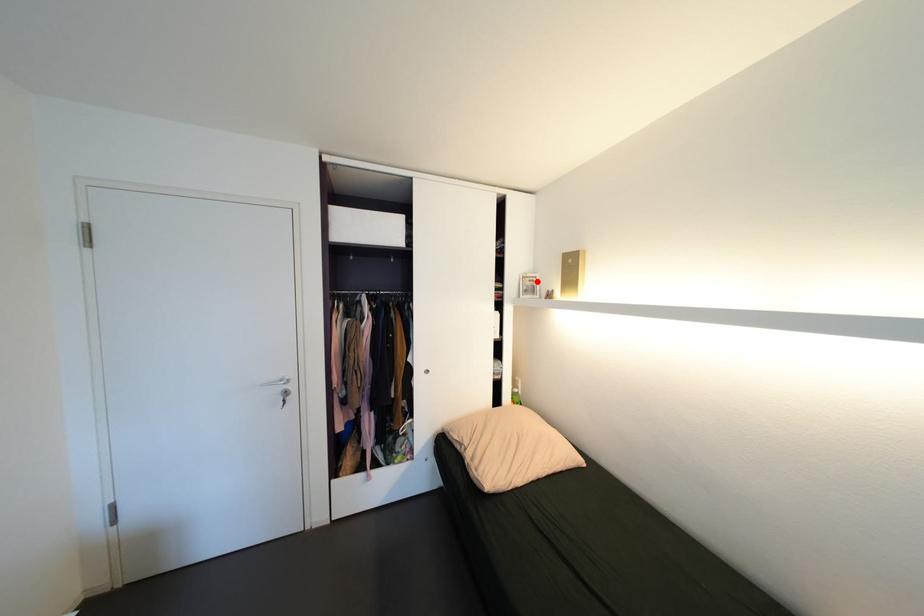
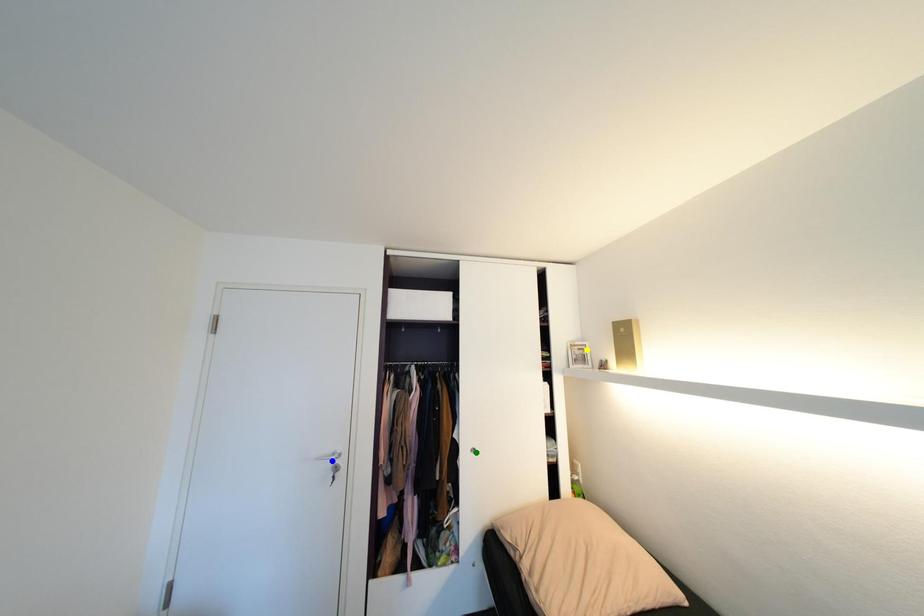
Question: I am providing you with two images of the same scene from different viewpoints. A red point is marked on the first image. You are given multiple points on the second image. Which spot in image 2 lines up with the point in image 1?

Choices:
 (A) blue point
 (B) yellow point
 (C) green point

Answer: (B)